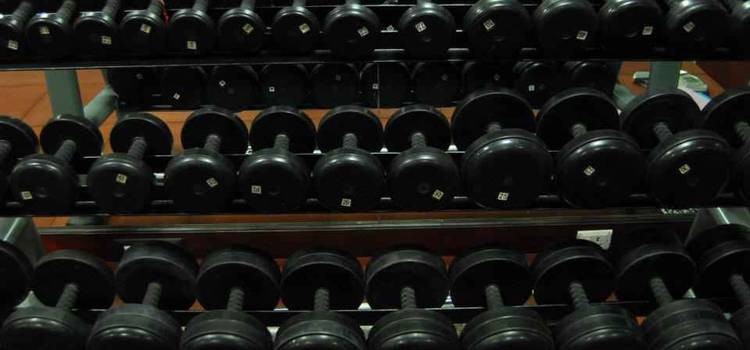
Image resolution: width=750 pixels, height=350 pixels. I want to click on dumbbell rack 2, so click(378, 160).